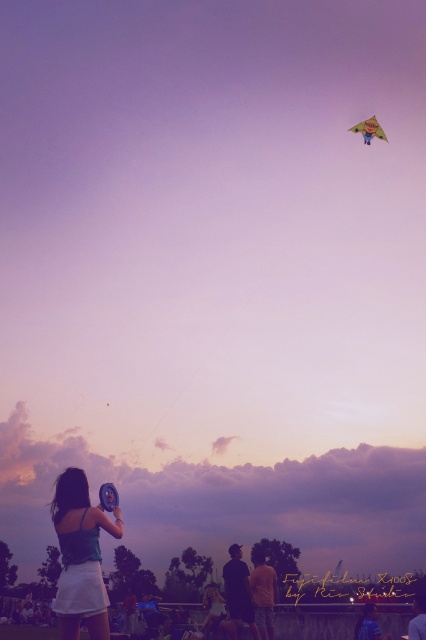
Is matte teal tank top at lower left positioned at the back of yellow fabric kite at upper center?

No.

Is matte teal tank top at lower left above yellow fabric kite at upper center?

Incorrect, matte teal tank top at lower left is not positioned above yellow fabric kite at upper center.

The width and height of the screenshot is (426, 640). What are the coordinates of `matte teal tank top at lower left` in the screenshot? It's located at (80, 556).

The width and height of the screenshot is (426, 640). Find the location of `matte teal tank top at lower left`. matte teal tank top at lower left is located at coordinates (80, 556).